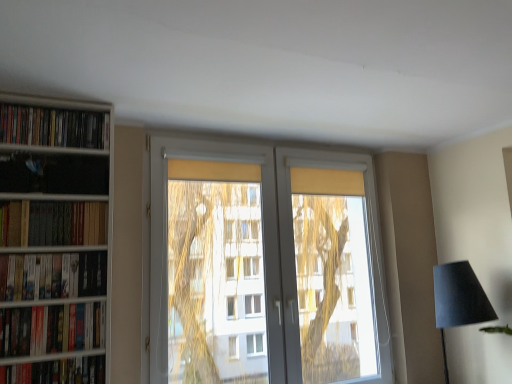
Question: From the image's perspective, would you say matte black bookshelf at left, positioned as the third book in bottom-to-top order, is positioned over white plastic window at center?

Choices:
 (A) no
 (B) yes

Answer: (B)

Question: Is matte black bookshelf at left, positioned as the third book in bottom-to-top order, positioned before white plastic window at center?

Choices:
 (A) yes
 (B) no

Answer: (A)

Question: From the image's perspective, is matte black bookshelf at left, positioned as the third book in bottom-to-top order, under white plastic window at center?

Choices:
 (A) yes
 (B) no

Answer: (B)

Question: Does matte black bookshelf at left, positioned as the third book in bottom-to-top order, have a lesser height compared to white plastic window at center?

Choices:
 (A) no
 (B) yes

Answer: (B)

Question: Considering the relative sizes of matte black bookshelf at left, positioned as the third book in bottom-to-top order, and white plastic window at center in the image provided, is matte black bookshelf at left, positioned as the third book in bottom-to-top order, taller than white plastic window at center?

Choices:
 (A) yes
 (B) no

Answer: (B)

Question: Is matte black bookshelf at left, positioned as the third book in bottom-to-top order, not within white plastic window at center?

Choices:
 (A) no
 (B) yes

Answer: (B)

Question: Is wooden bookshelf at left not within white plastic window at center?

Choices:
 (A) no
 (B) yes

Answer: (B)

Question: Considering the relative sizes of wooden bookshelf at left and white plastic window at center in the image provided, is wooden bookshelf at left shorter than white plastic window at center?

Choices:
 (A) yes
 (B) no

Answer: (A)

Question: Is wooden bookshelf at left positioned in front of white plastic window at center?

Choices:
 (A) no
 (B) yes

Answer: (B)

Question: From a real-world perspective, is wooden bookshelf at left beneath white plastic window at center?

Choices:
 (A) no
 (B) yes

Answer: (A)

Question: Would you say wooden bookshelf at left is a long distance from white plastic window at center?

Choices:
 (A) no
 (B) yes

Answer: (A)

Question: From the image's perspective, is wooden bookshelf at left above white plastic window at center?

Choices:
 (A) yes
 (B) no

Answer: (A)

Question: Is matte black lampshade at lower right smaller than hardcover book at lower left, the first book in the bottom-to-top sequence?

Choices:
 (A) no
 (B) yes

Answer: (A)